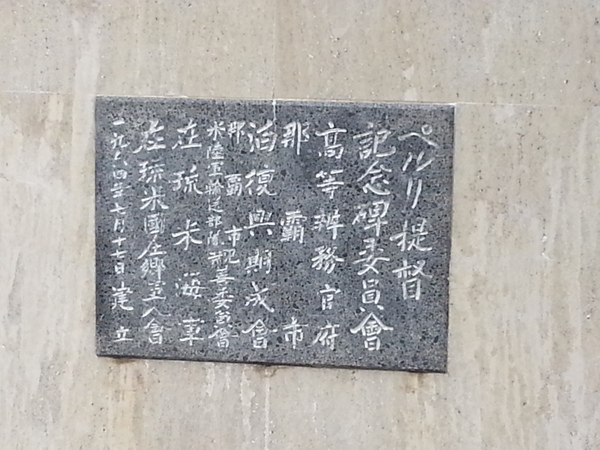
The width and height of the screenshot is (600, 450). Find the location of `tan and ivory tile`. tan and ivory tile is located at coordinates (520, 266).